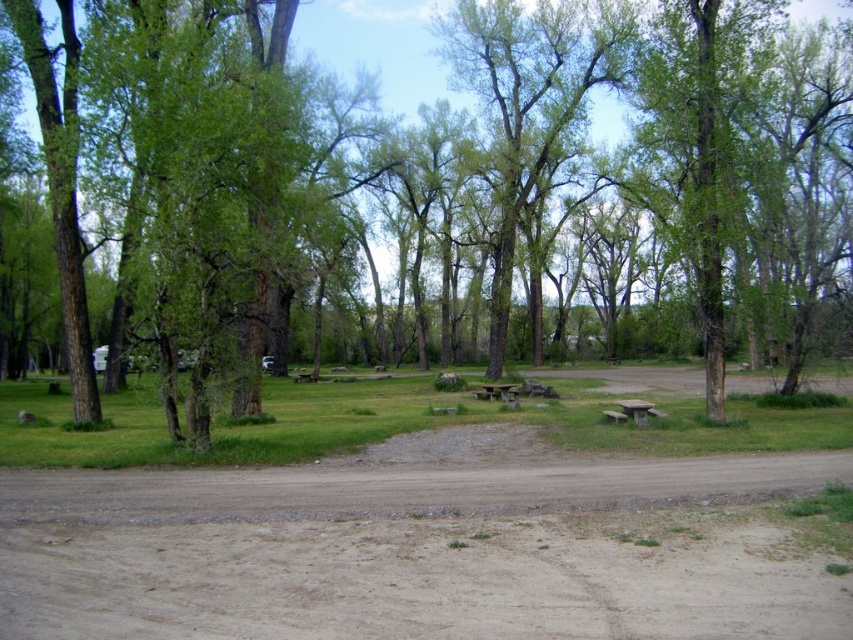
Question: Observing the image, what is the correct spatial positioning of brown sandy dirt field at center in reference to wooden picnic table at center?

Choices:
 (A) right
 (B) left

Answer: (A)

Question: Can you confirm if brown sandy dirt field at center is bigger than stone textured picnic table at center?

Choices:
 (A) yes
 (B) no

Answer: (A)

Question: Does green leafy tree at center have a lesser width compared to wooden picnic table at center?

Choices:
 (A) no
 (B) yes

Answer: (A)

Question: Among these objects, which one is farthest from the camera?

Choices:
 (A) brown sandy dirt field at center
 (B) wooden picnic table at center

Answer: (B)

Question: Which point is farther to the camera?

Choices:
 (A) (648, 412)
 (B) (469, 536)

Answer: (A)

Question: Which point is farther to the camera?

Choices:
 (A) wooden picnic table at center
 (B) stone textured picnic table at center
 (C) green leafy tree at center

Answer: (A)